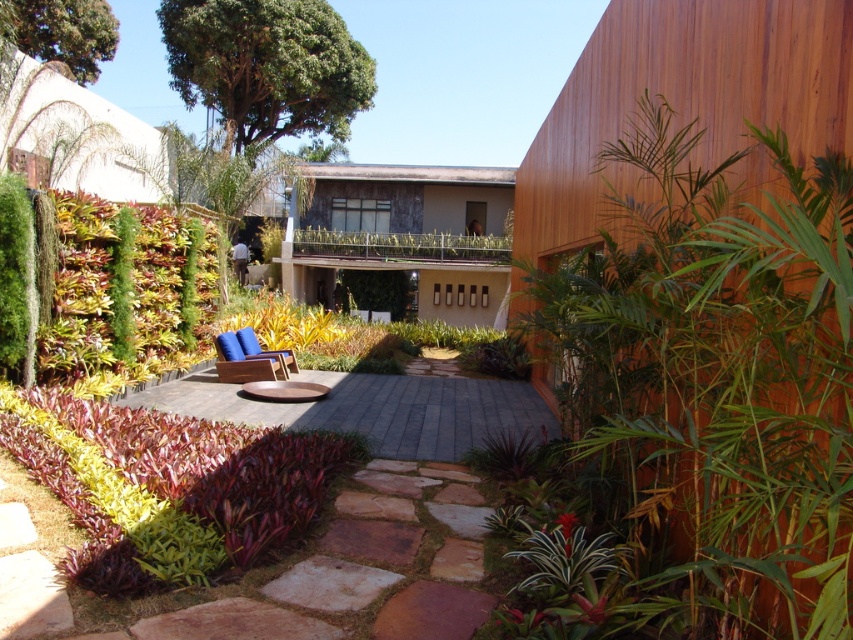
Is green leafy plant at right taller than green leafy hedge at left?

Yes.

Is point (807, 257) less distant than point (202, 273)?

Yes, point (807, 257) is closer to viewer.

Locate an element on the screen. green leafy plant at right is located at coordinates (714, 385).

Which of these two, green leafy hedge at center or blue fabric chair at center, stands shorter?

With less height is blue fabric chair at center.

Describe the element at coordinates (401, 244) in the screenshot. I see `green leafy hedge at center` at that location.

Identify the location of green leafy hedge at center. Image resolution: width=853 pixels, height=640 pixels. (401, 244).

Does wooden balcony at center have a larger size compared to smooth stone path at center?

Indeed, wooden balcony at center has a larger size compared to smooth stone path at center.

Is point (421, 310) farther from camera compared to point (213, 372)?

That is True.

Between point (482, 298) and point (515, 429), which one is positioned behind?

The point (482, 298) is more distant.

Identify the location of wooden balcony at center. The image size is (853, 640). (405, 234).